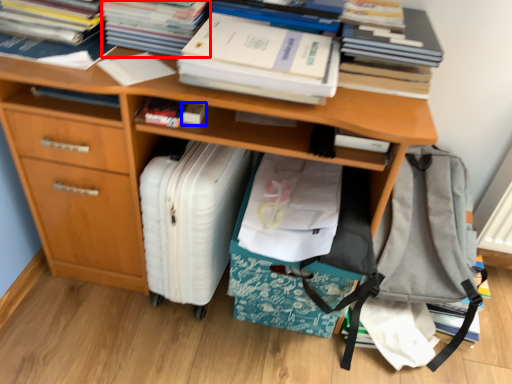
Question: Which point is further to the camera, paperback book (highlighted by a red box) or book (highlighted by a blue box)?

Choices:
 (A) paperback book
 (B) book

Answer: (B)